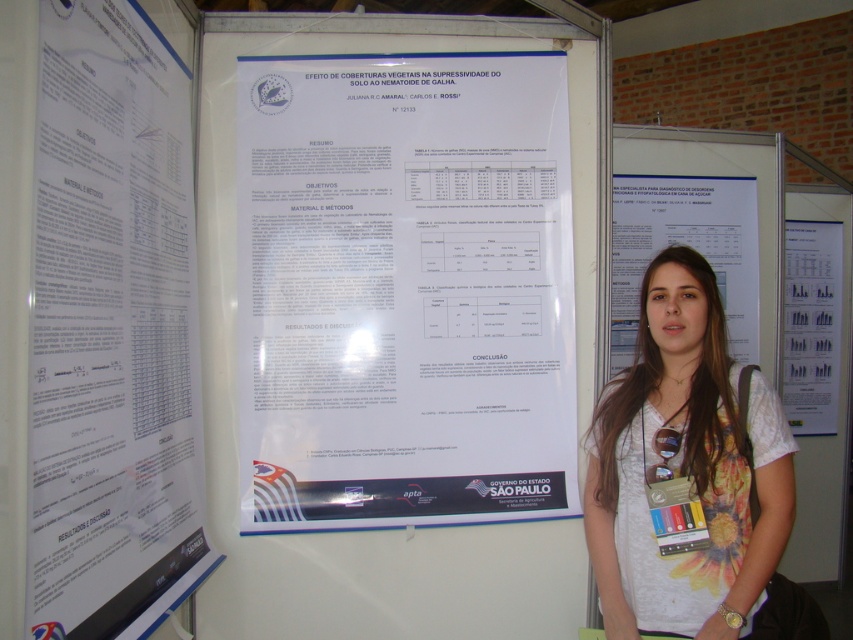
Based on the photo, you are an attendee at a conference and see the white paper poster at center and the white paper at center. You need to take a photo of both. Since you are holding your phone in one hand, can you fit both items in the frame without moving your phone?

The white paper poster at center and white paper at center are 4.04 feet apart from each other. Since the distance between them is more than typical phone camera frame width at that distance, you might need to move closer or take two separate photos to capture both items fully.

Where is the white paper poster at center located in the image?

The white paper poster at center is located at point (404,291).

You are a conference attendee trying to read the title of the poster. You see the white paper poster at center and the white paper poster at upper left. Which one is physically closer to you?

The white paper poster at center is positioned over white paper poster at upper left, so the white paper poster at center is closer to you.